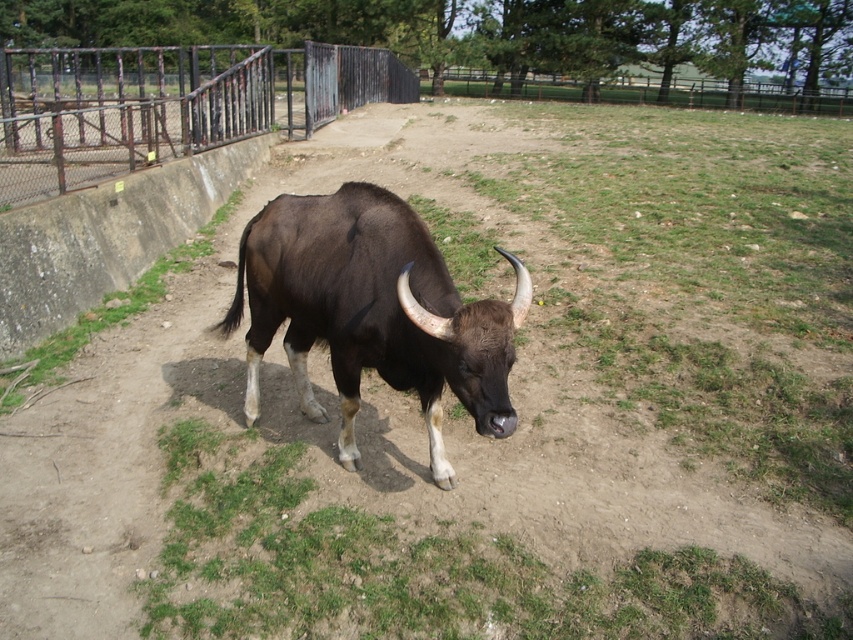
You are standing at the entrance of the enclosure and want to take a photo of the brown glossy bull at center. According to the coordinates provided, where should you position yourself to ensure the bull is centered in your camera frame?

To center the brown glossy bull at center in your camera frame, position yourself directly in front of the coordinates point at [372,312], which is where the bull is located.

You are a zookeeper who needs to place a new feeding station in the enclosure. The station must be placed at least 2 meters away from the bull to ensure safety. Given the bull is at point (372, 312), can you place the feeding station at point 0.5, 0.5? Please explain your reasoning.

The bull is located at point (372, 312). The distance between this point and the proposed feeding station at 0.5, 0.5 is approximately 0.016 meters, which is much less than the required 2 meters. Therefore, placing the feeding station at 0.5, 0.5 would not be safe as it is too close to the bull.

You are a zookeeper trying to determine if the brown glossy bull at center can fit through the gap between the rusty metal fence at upper center and the concrete wall. Based on their sizes, can the bull pass through?

The brown glossy bull at center is narrower than the rusty metal fence at upper center, so it might be able to pass through the gap if the distance between the fence and the wall is sufficient. However, the bull might still be too large to fit comfortably or safely through such a narrow space.